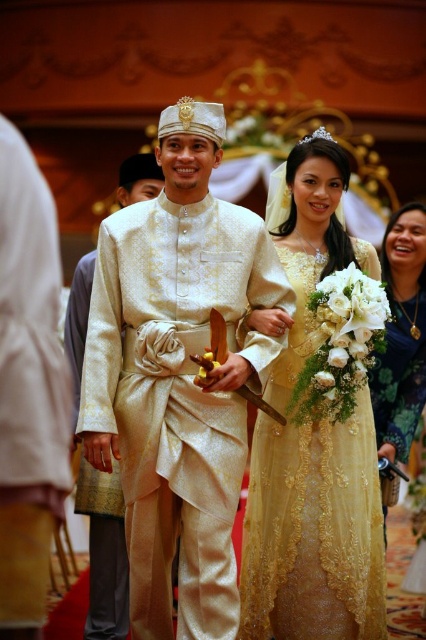
You are a photographer at the wedding and want to capture a closeup shot of both the matte gold robe at left and the matte gold dress at lower right. Which one should you focus on first to ensure it appears sharp in the photo?

You should focus on the matte gold robe at left first because it is closer to the viewer than the matte gold dress at lower right, so adjusting focus from near to far will help both appear sharp.

You are a photographer at the wedding and need to capture a closeup shot of both the matte gold robe at left and the couple. Since your camera has a limited focus range of 30 meters, will you be able to get both in focus?

The matte gold robe at left and the couple are 32.74 meters apart, which exceeds the camera focus range of 30 meters. Therefore, you cannot get both in focus.

You are a photographer standing next to the camera. You want to take a photo of the matte gold robe at left. Can you capture the entire robe in one shot without moving the camera? Explain why or why not.

The matte gold robe at left and camera are 32.74 meters apart from each other. At this distance, it would be difficult to capture the entire robe in one shot without moving the camera because the robe would appear too small in the frame.